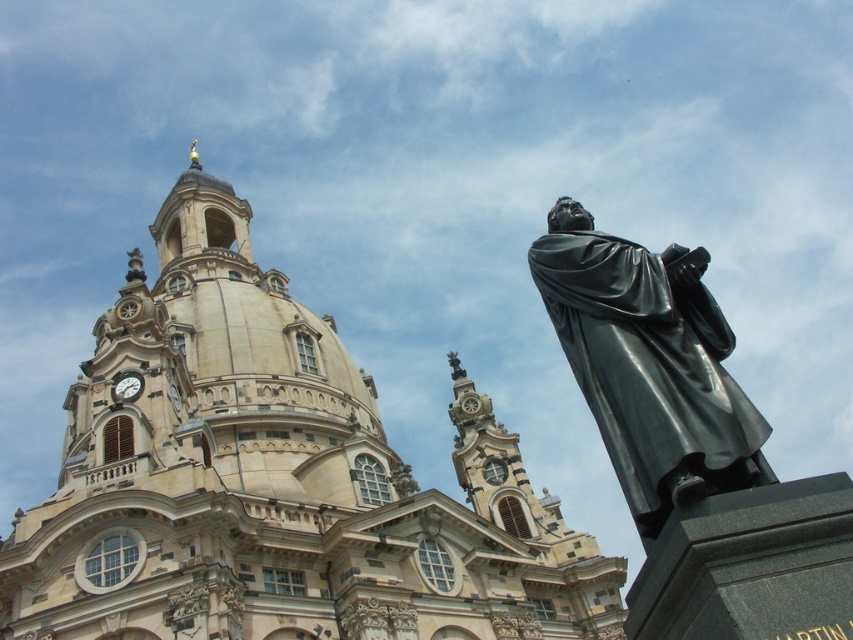
Question: Is beige stone church at center to the right of black polished statue at right from the viewer's perspective?

Choices:
 (A) no
 (B) yes

Answer: (A)

Question: Among these points, which one is nearest to the camera?

Choices:
 (A) (198, 269)
 (B) (668, 285)

Answer: (B)

Question: Can you confirm if beige stone church at center is smaller than black polished statue at right?

Choices:
 (A) yes
 (B) no

Answer: (B)

Question: In this image, where is beige stone church at center located relative to black polished statue at right?

Choices:
 (A) right
 (B) left

Answer: (B)